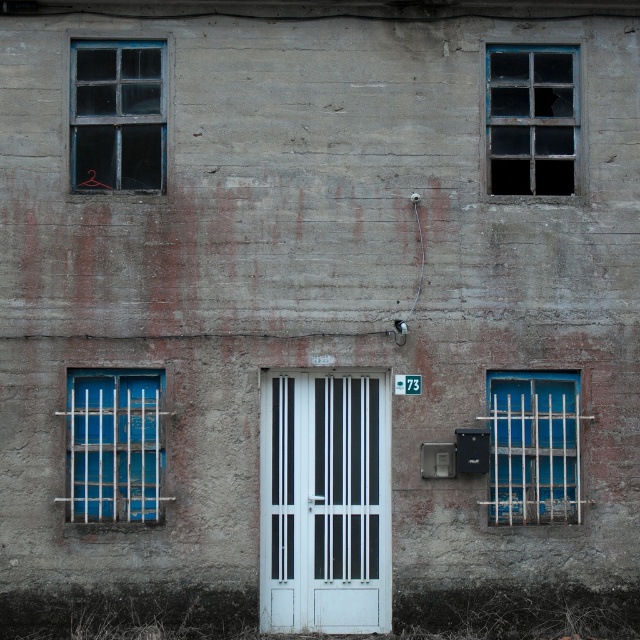
Who is more distant from viewer, [371,474] or [131,160]?

The point [371,474] is behind.

Between white glossy door at center and clear glass window at upper left, which one appears on the left side from the viewer's perspective?

Positioned to the left is clear glass window at upper left.

Between point (339, 480) and point (76, 83), which one is positioned in front?

Point (339, 480) is more forward.

Locate an element on the screen. The image size is (640, 640). white glossy door at center is located at coordinates (324, 502).

Is blue painted metal bars at lower left shorter than clear glass window at upper left?

No, blue painted metal bars at lower left is not shorter than clear glass window at upper left.

Can you confirm if blue painted metal bars at lower left is thinner than clear glass window at upper left?

No.

Find the location of `blue painted metal bars at lower left`. blue painted metal bars at lower left is located at coordinates (x=113, y=444).

Does white glossy door at center have a greater height compared to blue painted metal bars at lower left?

Correct, white glossy door at center is much taller as blue painted metal bars at lower left.

Is white glossy door at center smaller than blue painted metal bars at lower left?

Actually, white glossy door at center might be larger than blue painted metal bars at lower left.

Measure the distance between point (376, 435) and camera.

11.93 meters

Identify the location of white glossy door at center. This screenshot has height=640, width=640. (324, 502).